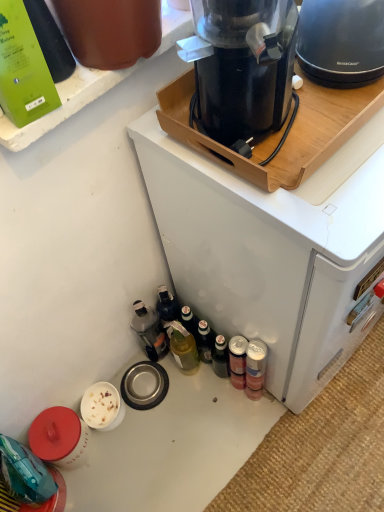
Question: Is black plastic coffee maker at upper center, which is the first kitchen appliance from left to right, to the left of translucent plastic bottle at lower left, arranged as the 2th bottle when viewed from the top, from the viewer's perspective?

Choices:
 (A) no
 (B) yes

Answer: (A)

Question: Does black plastic coffee maker at upper center, which is the first kitchen appliance from left to right, lie behind translucent plastic bottle at lower left, placed as the first bottle when sorted from back to front?

Choices:
 (A) yes
 (B) no

Answer: (B)

Question: From the image's perspective, does black plastic coffee maker at upper center, which is the first kitchen appliance from left to right, appear lower than translucent plastic bottle at lower left, arranged as the second bottle when ordered from the bottom?

Choices:
 (A) yes
 (B) no

Answer: (B)

Question: From a real-world perspective, is black plastic coffee maker at upper center, which appears as the second kitchen appliance when viewed from the right, positioned over translucent plastic bottle at lower left, acting as the 2th bottle starting from the right, based on gravity?

Choices:
 (A) no
 (B) yes

Answer: (B)

Question: Considering the relative sizes of black plastic coffee maker at upper center, which is the first kitchen appliance from left to right, and translucent plastic bottle at lower left, which is the third bottle in front-to-back order, in the image provided, is black plastic coffee maker at upper center, which is the first kitchen appliance from left to right, thinner than translucent plastic bottle at lower left, which is the third bottle in front-to-back order,?

Choices:
 (A) yes
 (B) no

Answer: (B)

Question: Is black plastic coffee maker at upper center, which is the first kitchen appliance from left to right, aimed at translucent plastic bottle at lower left, acting as the 2th bottle starting from the right?

Choices:
 (A) yes
 (B) no

Answer: (B)

Question: Is black plastic coffee maker at upper center to the right of metallic silver can at lower right, the 2th bottle viewed from the back, from the viewer's perspective?

Choices:
 (A) yes
 (B) no

Answer: (A)

Question: Would you say metallic silver can at lower right, marked as the second bottle in a front-to-back arrangement, is part of black plastic coffee maker at upper center's contents?

Choices:
 (A) no
 (B) yes

Answer: (A)

Question: Can you confirm if black plastic coffee maker at upper center is taller than metallic silver can at lower right, which appears as the third bottle when viewed from the top?

Choices:
 (A) no
 (B) yes

Answer: (B)

Question: Is black plastic coffee maker at upper center turned away from metallic silver can at lower right, which appears as the 1th bottle when ordered from the bottom?

Choices:
 (A) no
 (B) yes

Answer: (A)

Question: Does black plastic coffee maker at upper center touch metallic silver can at lower right, which appears as the third bottle when viewed from the top?

Choices:
 (A) yes
 (B) no

Answer: (B)

Question: From a real-world perspective, is black plastic coffee maker at upper center on metallic silver can at lower right, the 2th bottle viewed from the back?

Choices:
 (A) no
 (B) yes

Answer: (B)

Question: Is matte black kettle at upper right, which appears as the 2th kitchen appliance when viewed from the left, directly adjacent to black plastic coffee maker at upper center?

Choices:
 (A) no
 (B) yes

Answer: (A)